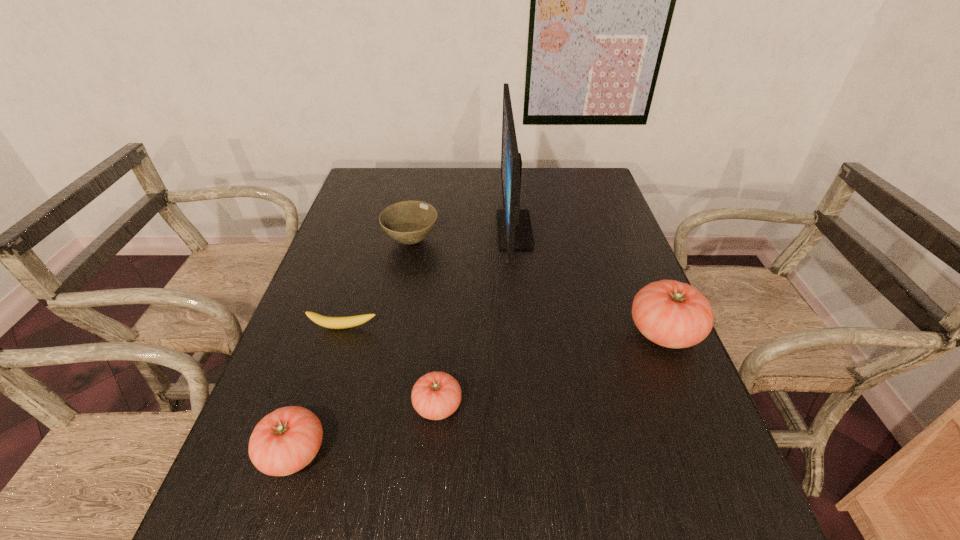
Identify the location of bowl that is positioned at the left edge. (409, 222).

Locate an element on the screen. This screenshot has width=960, height=540. banana that is at the left edge is located at coordinates (351, 321).

The height and width of the screenshot is (540, 960). I want to click on object situated at the right edge, so click(x=672, y=314).

The image size is (960, 540). I want to click on object at the near left corner, so click(286, 440).

In order to click on vacant region at the far edge of the desktop in this screenshot , I will do `click(555, 172)`.

This screenshot has height=540, width=960. I want to click on vacant space at the near edge of the desktop, so click(527, 480).

Find the location of a particular element. This screenshot has width=960, height=540. vacant space at the left edge is located at coordinates (338, 242).

Locate an element on the screen. vacant space at the right edge is located at coordinates (613, 241).

Where is `free location at the far right corner`? free location at the far right corner is located at coordinates (603, 180).

I want to click on free space between the bowl and the tallest object, so pyautogui.click(x=463, y=235).